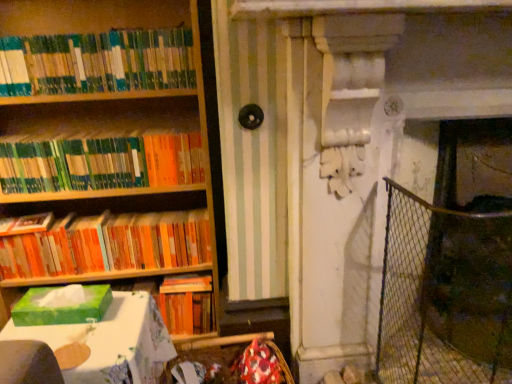
Question: Do you think wire mesh fence at right is within green matte bookshelf at upper left, acting as the 2th book starting from the bottom, or outside of it?

Choices:
 (A) inside
 (B) outside

Answer: (B)

Question: From a real-world perspective, relative to green matte bookshelf at upper left, the 2th book in the top-to-bottom sequence, is wire mesh fence at right vertically above or below?

Choices:
 (A) above
 (B) below

Answer: (B)

Question: Based on their relative distances, which object is farther from the green matte tissue box at left?

Choices:
 (A) green matte bookshelf at upper left, the 1th book in the top-to-bottom sequence
 (B) orange matte bookshelf at left, which ranks as the 3th book in top-to-bottom order
 (C) green matte bookshelf at upper left, the 2th book in the top-to-bottom sequence
 (D) green cardboard tissue box at lower left
 (E) wire mesh fence at right

Answer: (E)

Question: Considering the real-world distances, which object is farthest from the orange matte bookshelf at left, which ranks as the 3th book in top-to-bottom order?

Choices:
 (A) green matte bookshelf at upper left, acting as the 2th book starting from the bottom
 (B) green matte tissue box at left
 (C) wire mesh fence at right
 (D) green matte bookshelf at upper left, the third book in the bottom-to-top sequence
 (E) green cardboard tissue box at lower left

Answer: (C)